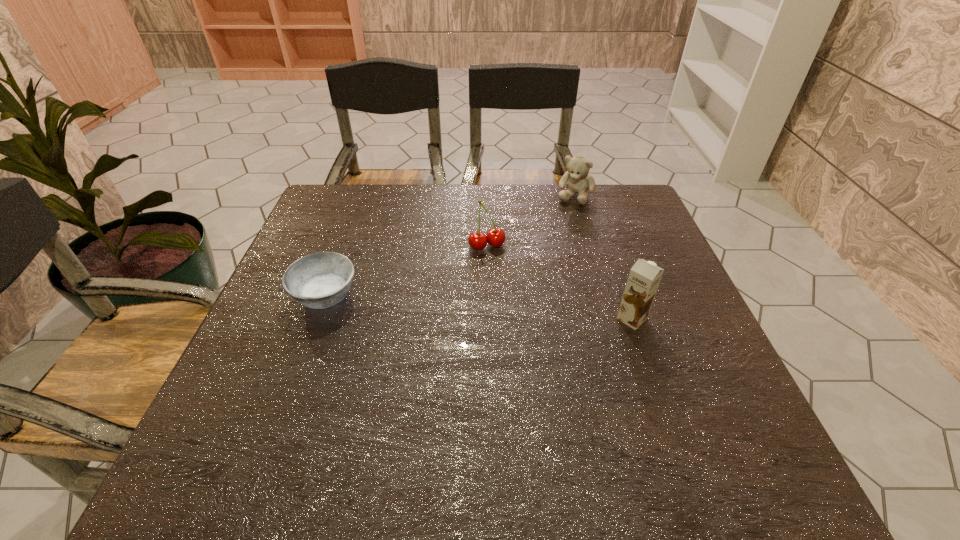
Identify the location of free location at the near edge. The width and height of the screenshot is (960, 540). (380, 409).

Where is `free space at the left edge of the desktop`? Image resolution: width=960 pixels, height=540 pixels. free space at the left edge of the desktop is located at coordinates (281, 280).

Locate an element on the screen. The width and height of the screenshot is (960, 540). free space at the right edge of the desktop is located at coordinates (672, 293).

Locate an element on the screen. This screenshot has width=960, height=540. free space at the far left corner is located at coordinates click(325, 197).

Where is `free space at the far right corner of the desktop`? Image resolution: width=960 pixels, height=540 pixels. free space at the far right corner of the desktop is located at coordinates (636, 215).

The height and width of the screenshot is (540, 960). In order to click on vacant space at the near right corner in this screenshot , I will do `click(722, 426)`.

Where is `free space that is in between the cherry and the ashtray`? free space that is in between the cherry and the ashtray is located at coordinates click(x=406, y=271).

Where is `blank region between the tallest object and the third object from right to left`? The width and height of the screenshot is (960, 540). blank region between the tallest object and the third object from right to left is located at coordinates (560, 282).

You are a GUI agent. You are given a task and a screenshot of the screen. Output one action in this format:
    pyautogui.click(x=<x>, y=<y>)
    Task: Click on the free point between the farthest object and the tallest object
    Image resolution: width=960 pixels, height=540 pixels.
    Given the screenshot: What is the action you would take?
    pyautogui.click(x=603, y=257)

Locate an element on the screen. Image resolution: width=960 pixels, height=540 pixels. unoccupied area between the leftmost object and the second farthest object is located at coordinates (406, 271).